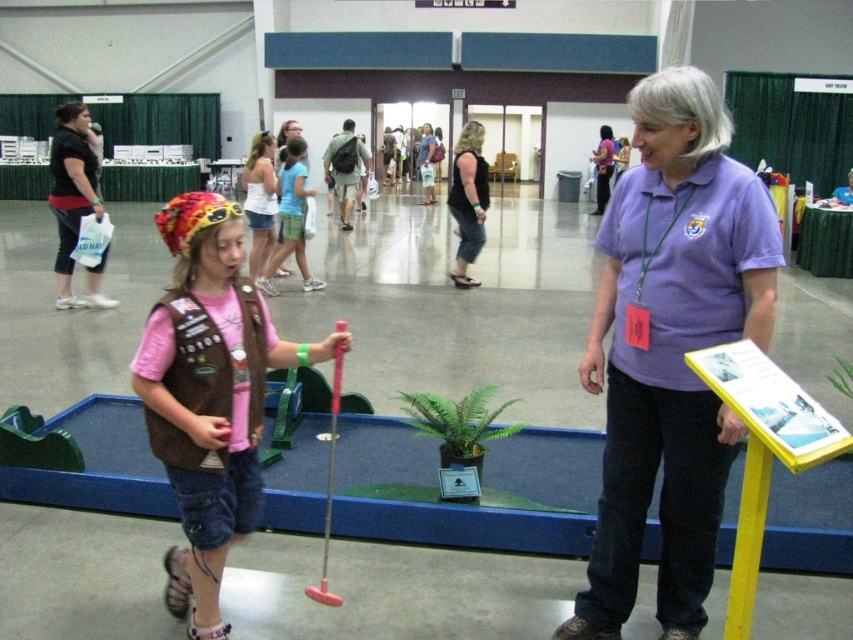
Between light blue cotton shirt at center and purple shirt at center, which one appears on the right side from the viewer's perspective?

purple shirt at center

Which is more to the left, light blue cotton shirt at center or purple shirt at center?

Positioned to the left is light blue cotton shirt at center.

Who is more distant from viewer, (299, 193) or (604, 141)?

The point (604, 141) is behind.

Find the location of a particular element. light blue cotton shirt at center is located at coordinates (291, 218).

Measure the distance between point (112, 300) and camera.

23.89 feet

Is matte black shirt at left closer to the viewer compared to purple shirt at center?

Yes, matte black shirt at left is in front of purple shirt at center.

The width and height of the screenshot is (853, 640). What do you see at coordinates (74, 202) in the screenshot?
I see `matte black shirt at left` at bounding box center [74, 202].

Locate an element on the screen. matte black shirt at left is located at coordinates [74, 202].

Who is taller, purple cotton shirt at center or white cotton tank top at center?

purple cotton shirt at center is taller.

Between purple cotton shirt at center and white cotton tank top at center, which one appears on the left side from the viewer's perspective?

white cotton tank top at center is more to the left.

This screenshot has height=640, width=853. I want to click on purple cotton shirt at center, so [671, 348].